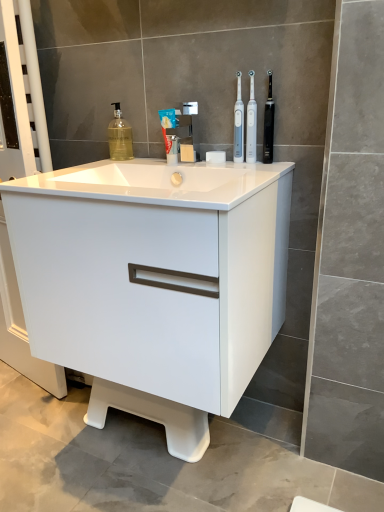
Locate an element on the screen. The image size is (384, 512). empty space that is to the right of chrome metallic faucet at upper center is located at coordinates coord(226,167).